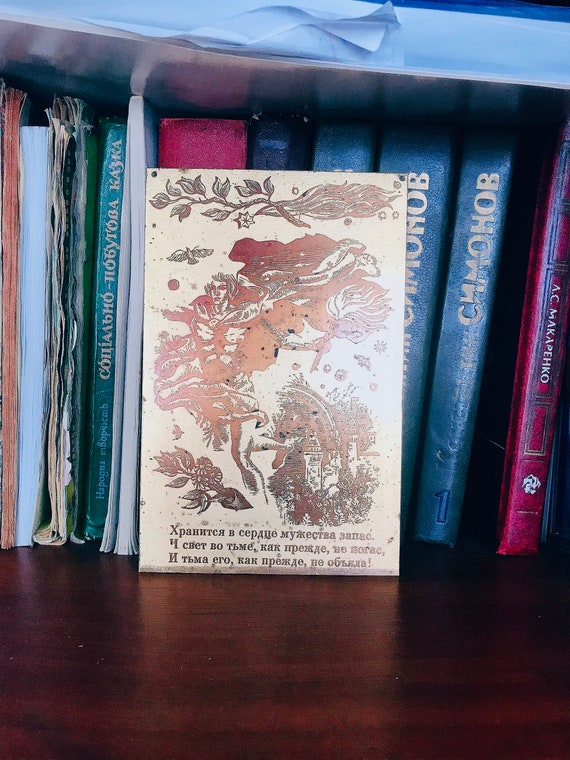
At what (x,y) coordinates should I click in order to perform the action: click on book. Please return your answer as a coordinate pair (x, y). Looking at the image, I should click on (112, 195), (197, 150), (294, 160), (329, 147), (416, 149), (470, 198), (547, 206).